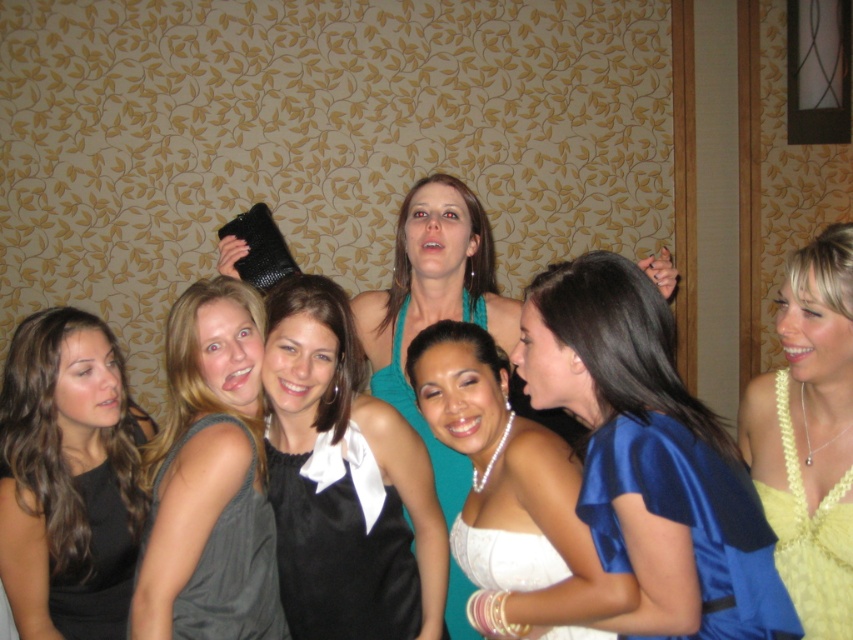
Who is lower down, matte gray dress at center or black satin dress at center?

black satin dress at center is lower down.

Between matte gray dress at center and black satin dress at center, which one is positioned higher?

matte gray dress at center

This screenshot has width=853, height=640. I want to click on matte gray dress at center, so click(x=210, y=477).

Can you confirm if yellow knitted dress at upper right is positioned below black satin dress at center?

Incorrect, yellow knitted dress at upper right is not positioned below black satin dress at center.

Is point (801, 483) closer to camera compared to point (416, 636)?

That is True.

Who is more distant from viewer, (x=788, y=499) or (x=312, y=577)?

Point (x=312, y=577)

The image size is (853, 640). I want to click on yellow knitted dress at upper right, so click(x=809, y=435).

Between point (572, 340) and point (392, 544), which one is positioned behind?

Point (392, 544)

Between point (654, 520) and point (286, 593), which one is positioned behind?

The point (286, 593) is more distant.

You are a GUI agent. You are given a task and a screenshot of the screen. Output one action in this format:
    pyautogui.click(x=<x>, y=<y>)
    Task: Click on the satin blue dress at center
    
    Given the screenshot: What is the action you would take?
    pyautogui.click(x=651, y=458)